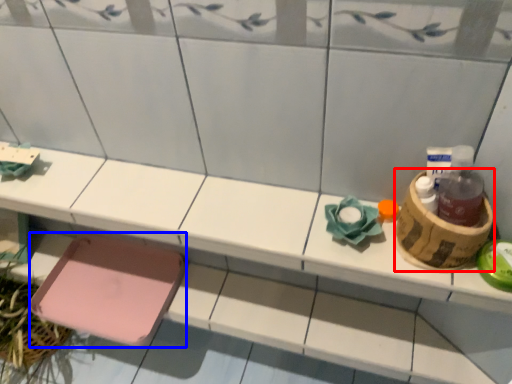
Question: Which point is closer to the camera, basket (highlighted by a red box) or step stool (highlighted by a blue box)?

Choices:
 (A) basket
 (B) step stool

Answer: (A)